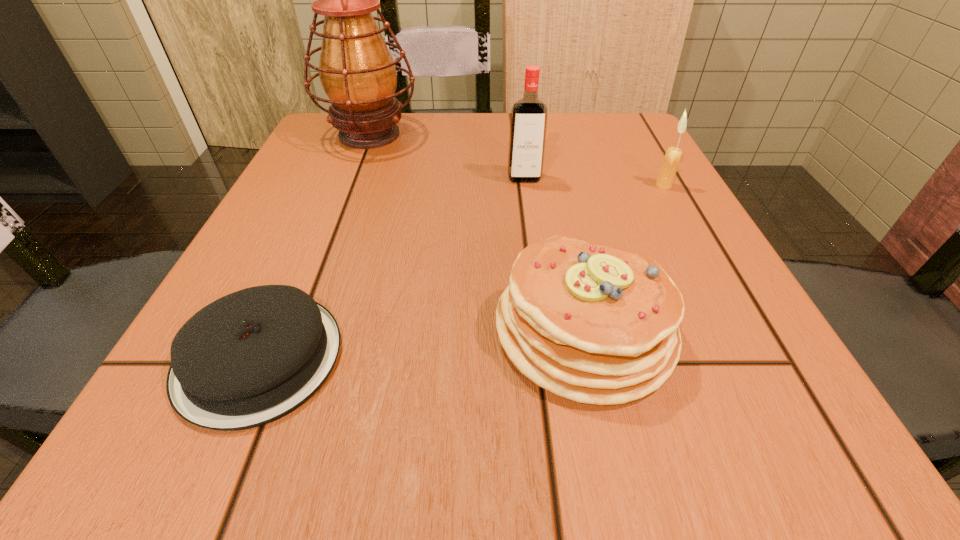
Identify the location of vacant space located on the front and back of the vodka. This screenshot has width=960, height=540. (542, 312).

You are a GUI agent. You are given a task and a screenshot of the screen. Output one action in this format:
    pyautogui.click(x=<x>, y=<y>)
    Task: Click on the blank space located 0.230m on the back of the candle
    
    Given the screenshot: What is the action you would take?
    pyautogui.click(x=632, y=127)

The image size is (960, 540). Identify the location of free space located 0.400m on the back of the right pancake. (543, 143).

The height and width of the screenshot is (540, 960). In order to click on vacant region located on the right of the left pancake in this screenshot , I will do `click(607, 357)`.

Locate an element on the screen. This screenshot has width=960, height=540. object present at the far edge is located at coordinates (357, 72).

This screenshot has width=960, height=540. I want to click on oil lamp that is at the left edge, so click(357, 72).

Where is `pancake at the left edge`? pancake at the left edge is located at coordinates (251, 357).

The height and width of the screenshot is (540, 960). Identify the location of candle positioned at the right edge. (673, 155).

Locate an element on the screen. The width and height of the screenshot is (960, 540). pancake that is at the right edge is located at coordinates (595, 324).

Identify the location of object positioned at the far left corner. The height and width of the screenshot is (540, 960). (357, 72).